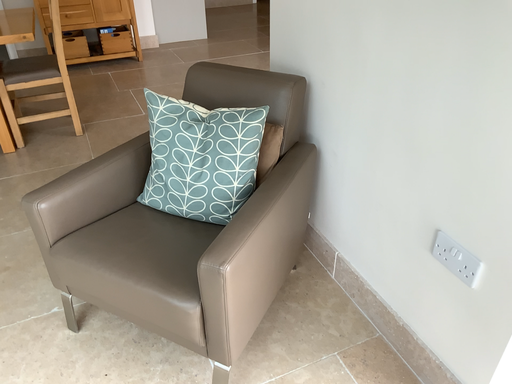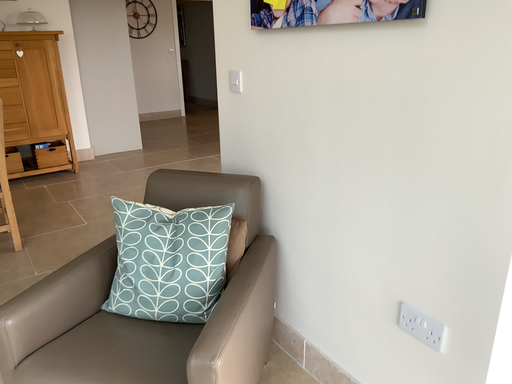
Question: How did the camera likely rotate when shooting the video?

Choices:
 (A) rotated downward
 (B) rotated upward

Answer: (B)